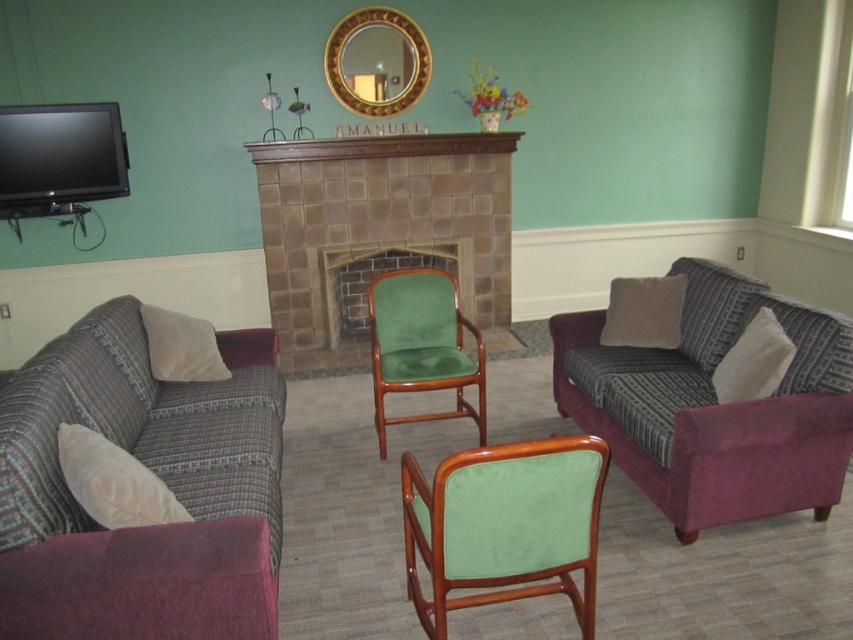
From the picture: Between brown tile fireplace at center and gold metallic mirror at upper center, which one has less height?

With less height is gold metallic mirror at upper center.

Who is more distant from viewer, (456, 138) or (338, 84)?

The point (338, 84) is behind.

This screenshot has height=640, width=853. I want to click on brown tile fireplace at center, so click(380, 228).

Which is behind, point (379, 330) or point (407, 35)?

The point (407, 35) is more distant.

At what (x,y) coordinates should I click in order to perform the action: click on green suede chair at center. Please return your answer as a coordinate pair (x, y). This screenshot has height=640, width=853. Looking at the image, I should click on (421, 344).

Which is behind, point (712, 524) or point (386, 13)?

The point (386, 13) is behind.

Can you confirm if plush purple couch at right is thinner than gold metallic mirror at upper center?

In fact, plush purple couch at right might be wider than gold metallic mirror at upper center.

Is point (631, 480) positioned after point (357, 112)?

No, it is not.

Where is `plush purple couch at right`? plush purple couch at right is located at coordinates (714, 404).